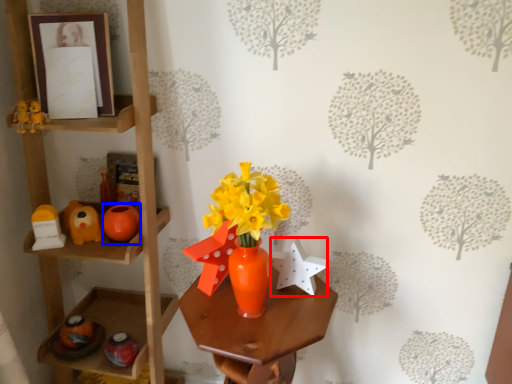
Question: Which object is closer to the camera taking this photo, toy (highlighted by a red box) or toy (highlighted by a blue box)?

Choices:
 (A) toy
 (B) toy

Answer: (A)